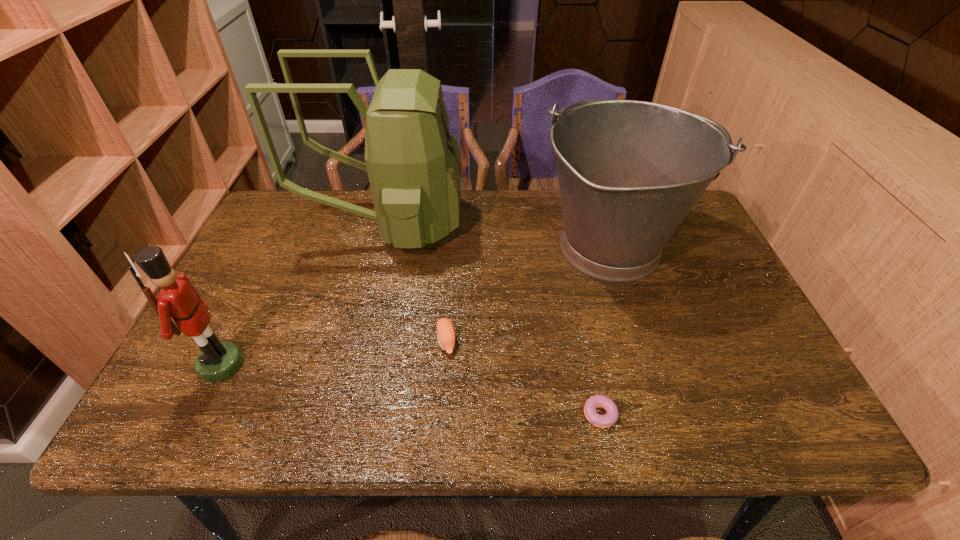
The height and width of the screenshot is (540, 960). Find the location of `vacant space located on the left of the nearest object`. vacant space located on the left of the nearest object is located at coordinates (441, 414).

This screenshot has width=960, height=540. Find the location of `backpack that is at the far edge`. backpack that is at the far edge is located at coordinates (414, 165).

At what (x,y) coordinates should I click in order to perform the action: click on bucket situated at the far edge. Please return your answer as a coordinate pair (x, y). Looking at the image, I should click on (629, 172).

What are the coordinates of `object located in the near edge section of the desktop` in the screenshot? It's located at (603, 421).

Locate an element on the screen. object at the left edge is located at coordinates [x=218, y=360].

Find the location of a particular element. The height and width of the screenshot is (540, 960). object at the right edge is located at coordinates (629, 172).

Identify the location of object situated at the far right corner. (629, 172).

The height and width of the screenshot is (540, 960). I want to click on vacant space at the far edge of the desktop, so click(x=336, y=222).

You are a GUI agent. You are given a task and a screenshot of the screen. Output one action in this format:
    pyautogui.click(x=<x>, y=<y>)
    Task: Click on the vacant space at the left edge of the desktop
    The height and width of the screenshot is (540, 960).
    Given the screenshot: What is the action you would take?
    pyautogui.click(x=224, y=291)

Where is `free space at the right edge of the desktop`? This screenshot has width=960, height=540. free space at the right edge of the desktop is located at coordinates (754, 339).